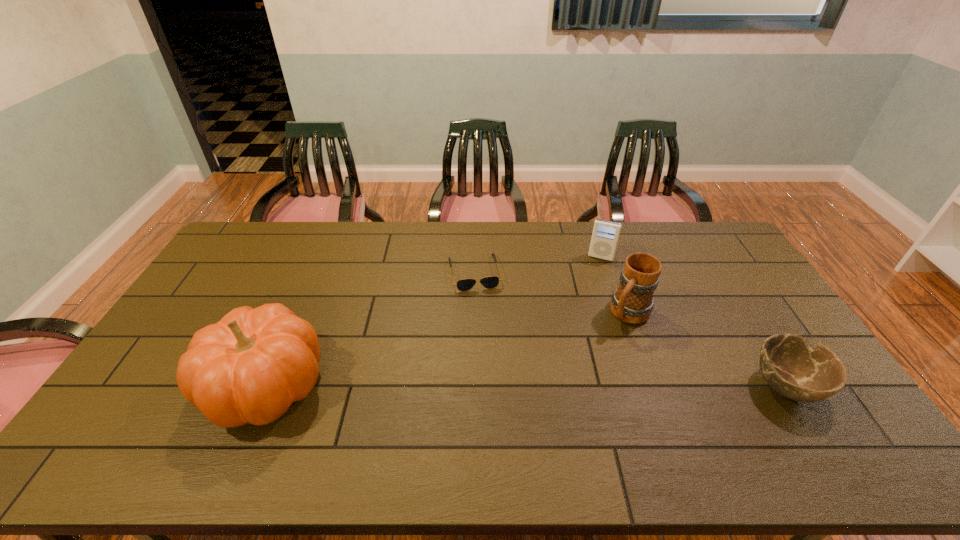
The image size is (960, 540). I want to click on vacant space on the desktop that is between the pumpkin and the rightmost object and is positioned on the front-facing side of the shortest object, so click(x=499, y=385).

Where is `free space on the desktop that is between the pumpkin and the second shortest object and is positioned on the front-facing side of the iPod`? free space on the desktop that is between the pumpkin and the second shortest object and is positioned on the front-facing side of the iPod is located at coordinates (563, 386).

Identify the location of free space on the desktop that is between the leftmost object and the second shortest object and is positioned on the side of the third farthest object with the handle. The image size is (960, 540). (571, 386).